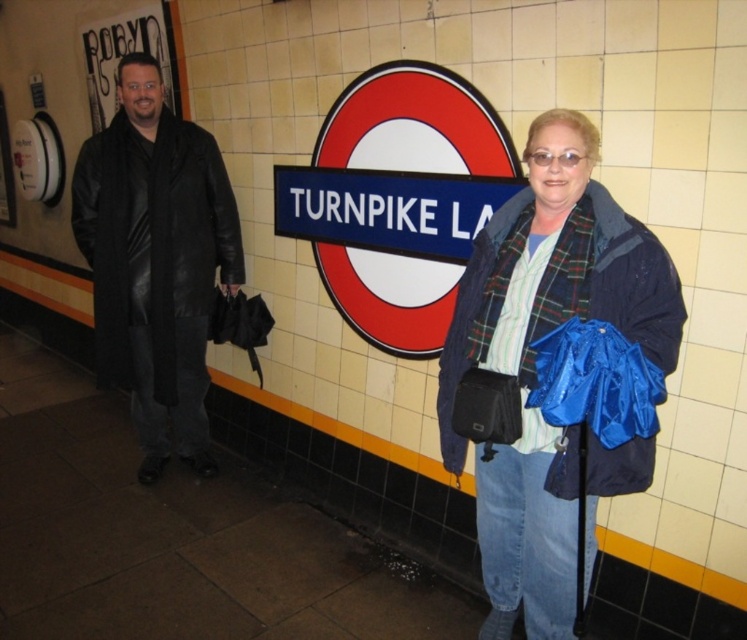
Question: Can you confirm if blue plaid scarf at center is positioned above black leather coat at left?

Choices:
 (A) no
 (B) yes

Answer: (A)

Question: Which point is closer to the camera?

Choices:
 (A) (452, 392)
 (B) (117, 168)

Answer: (A)

Question: Is blue plaid scarf at center positioned before black leather coat at left?

Choices:
 (A) no
 (B) yes

Answer: (B)

Question: Which of the following is the closest to the observer?

Choices:
 (A) (125, 157)
 (B) (557, 563)

Answer: (B)

Question: Can you confirm if blue plaid scarf at center is positioned below black leather coat at left?

Choices:
 (A) yes
 (B) no

Answer: (A)